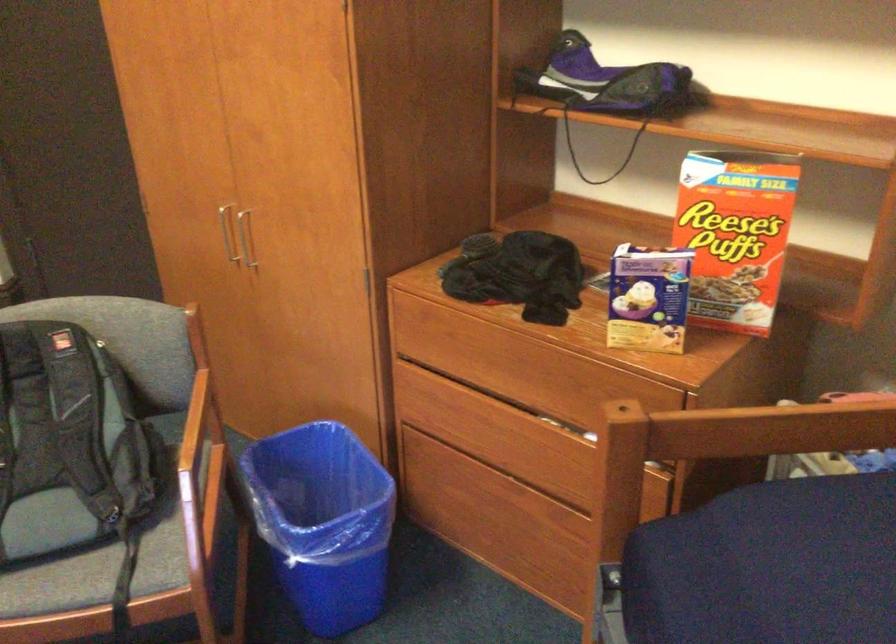
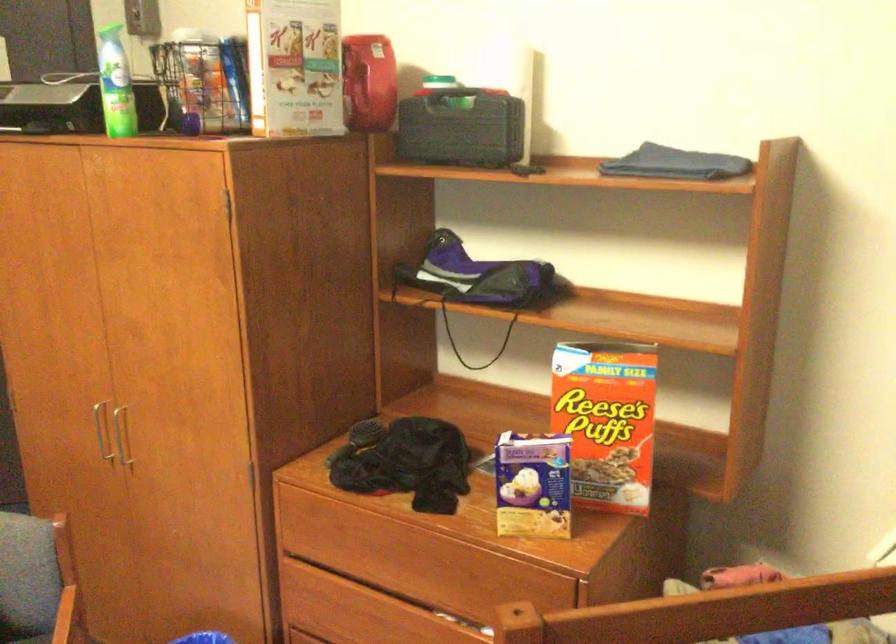
Find the pixel in the second image that matches pixel 604 82 in the first image.

(476, 275)